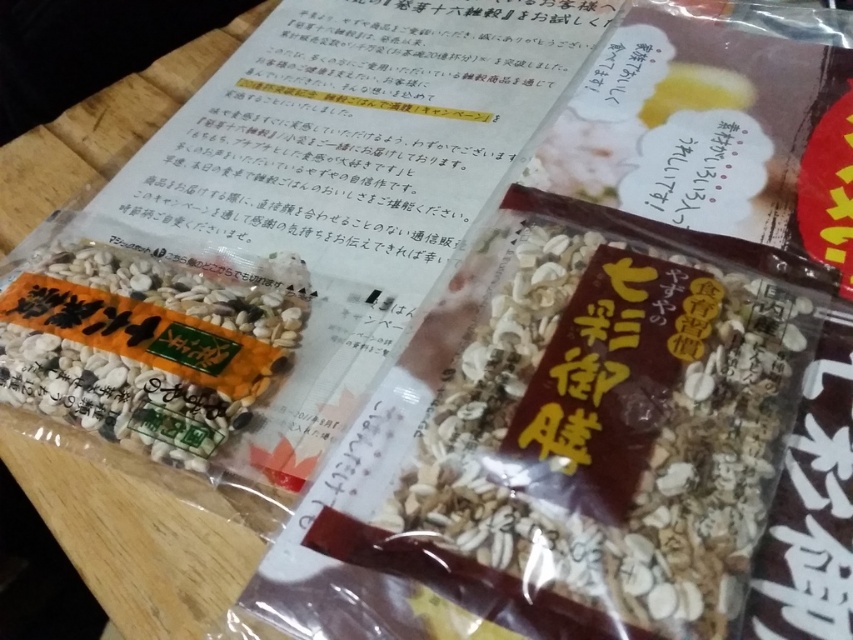
You are arranging two food items on a shelf. The brown matte granola at center and the white matte seeds at center. If you want to place them side by side from left to right, which one should be placed first on the left?

The white matte seeds at center should be placed first on the left because the brown matte granola at center is positioned on the right side of it.

You are standing in front of two packaged food items on a wooden table. You see a point labeled at coordinates (604, 435). Which item does this point correspond to?

The point labeled at coordinates (604, 435) corresponds to the brown matte granola at center.